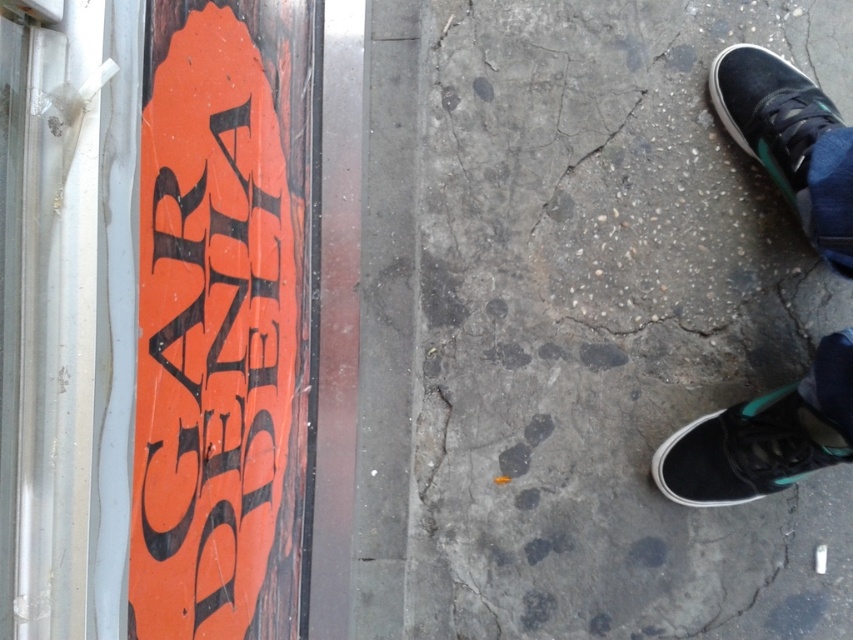
Question: Which point appears closest to the camera in this image?

Choices:
 (A) (776, 435)
 (B) (798, 70)
 (C) (711, 259)

Answer: (A)

Question: Which point is closer to the camera?

Choices:
 (A) pyautogui.click(x=535, y=465)
 (B) pyautogui.click(x=798, y=173)
 (C) pyautogui.click(x=770, y=52)
 (D) pyautogui.click(x=675, y=442)

Answer: (B)

Question: Among these objects, which one is nearest to the camera?

Choices:
 (A) black canvas shoes at lower right
 (B) black canvas shoe at lower right
 (C) gray concrete pavement at center

Answer: (A)

Question: Does black canvas shoes at lower right have a greater width compared to black canvas shoe at upper right?

Choices:
 (A) yes
 (B) no

Answer: (A)

Question: Does black canvas shoes at lower right have a smaller size compared to black canvas shoe at lower right?

Choices:
 (A) no
 (B) yes

Answer: (A)

Question: Where is black canvas shoes at lower right located in relation to black canvas shoe at lower right in the image?

Choices:
 (A) right
 (B) left

Answer: (A)